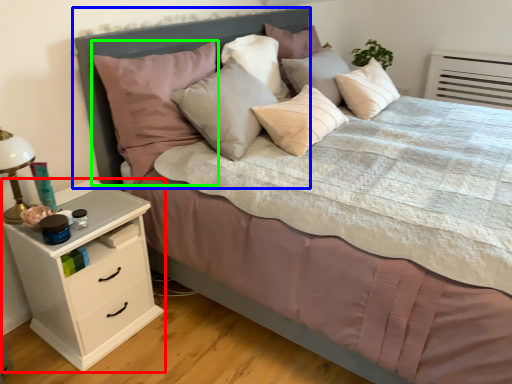
Question: Which object is positioned closest to chest of drawers (highlighted by a red box)? Select from headboard (highlighted by a blue box) and pillow (highlighted by a green box).

Choices:
 (A) headboard
 (B) pillow

Answer: (B)